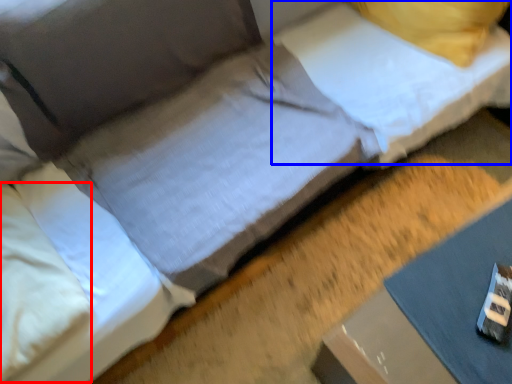
Question: Which of the following is the farthest to the observer, pillow (highlighted by a red box) or pillow (highlighted by a blue box)?

Choices:
 (A) pillow
 (B) pillow

Answer: (B)